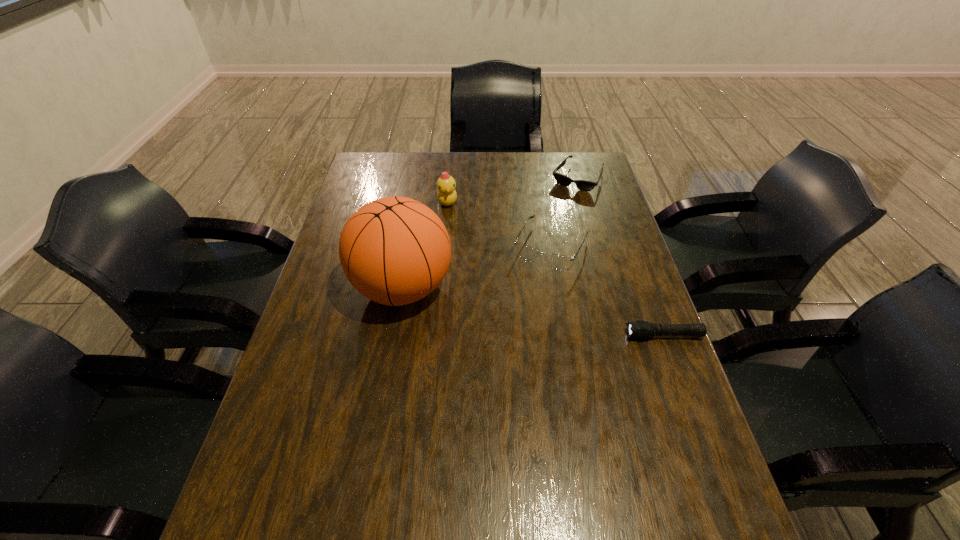
Locate an element on the screen. the tallest object is located at coordinates (394, 250).

This screenshot has width=960, height=540. I want to click on flashlight, so (640, 329).

You are a GUI agent. You are given a task and a screenshot of the screen. Output one action in this format:
    pyautogui.click(x=<x>, y=<y>)
    Task: Click on the spectacles
    
    Given the screenshot: What is the action you would take?
    pyautogui.click(x=558, y=262)

I want to click on the fourth shortest object, so click(x=446, y=193).

Identify the location of sunglasses. This screenshot has width=960, height=540. (583, 185).

Find the location of a particular element. free space located 0.390m on the back of the tallest object is located at coordinates (420, 182).

Locate an element on the screen. The width and height of the screenshot is (960, 540). free spot located at the lens end of the nearest object is located at coordinates (550, 335).

Locate an element on the screen. vacant space located at the lens end of the nearest object is located at coordinates (559, 335).

I want to click on vacant space located 0.320m at the lens end of the nearest object, so click(x=499, y=335).

Find the location of a particular element. vacant area situated on the front-facing side of the spectacles is located at coordinates (491, 357).